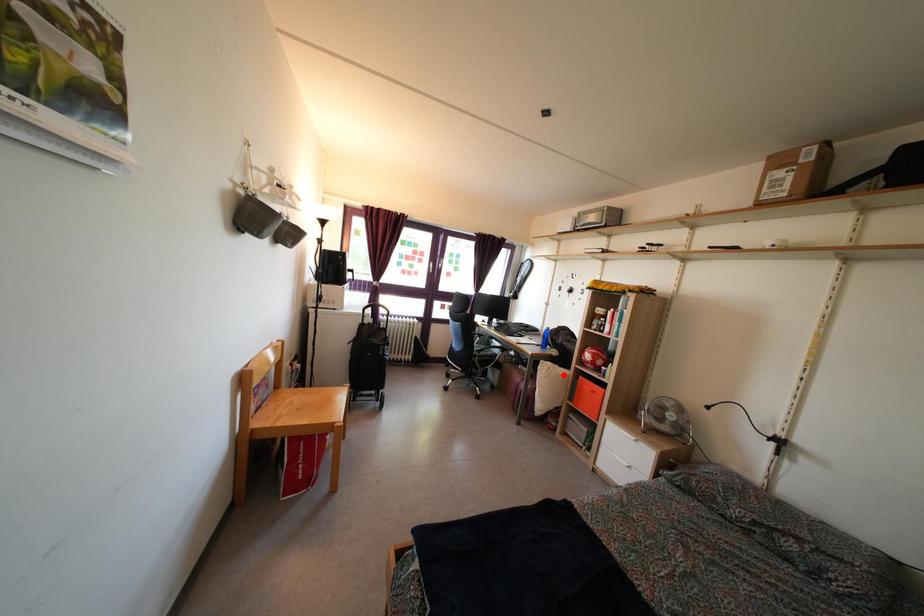
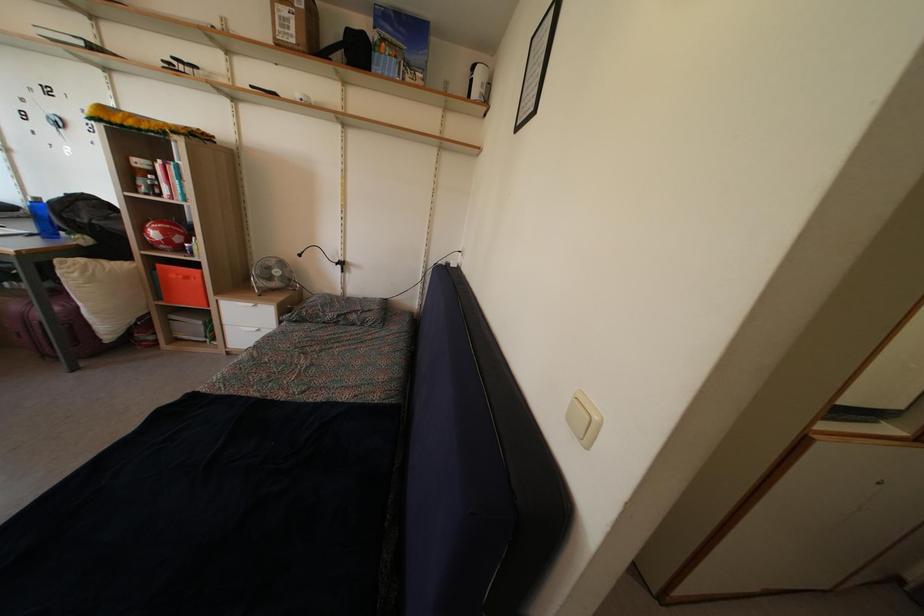
The point at the highlighted location is marked in the first image. Where is the corresponding point in the second image?

(116, 268)